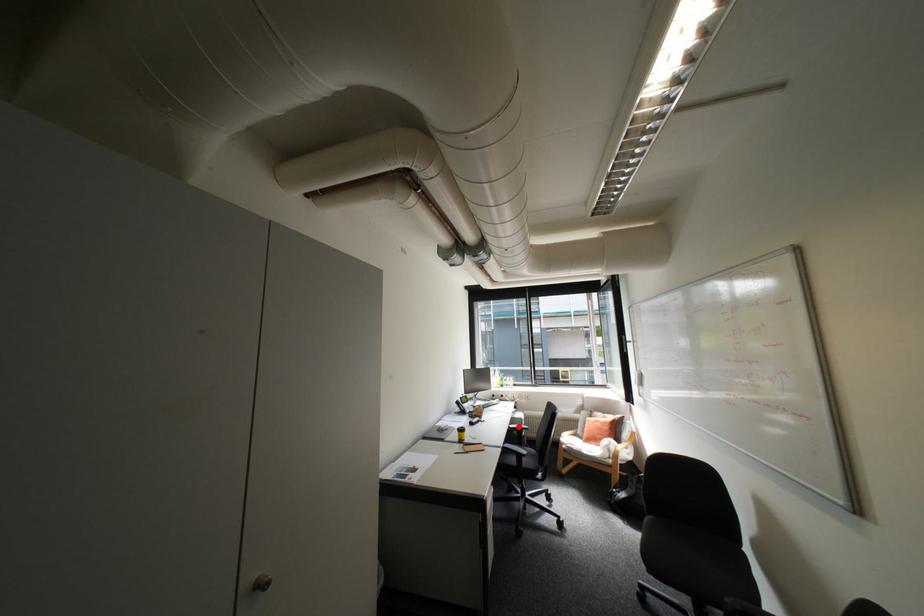
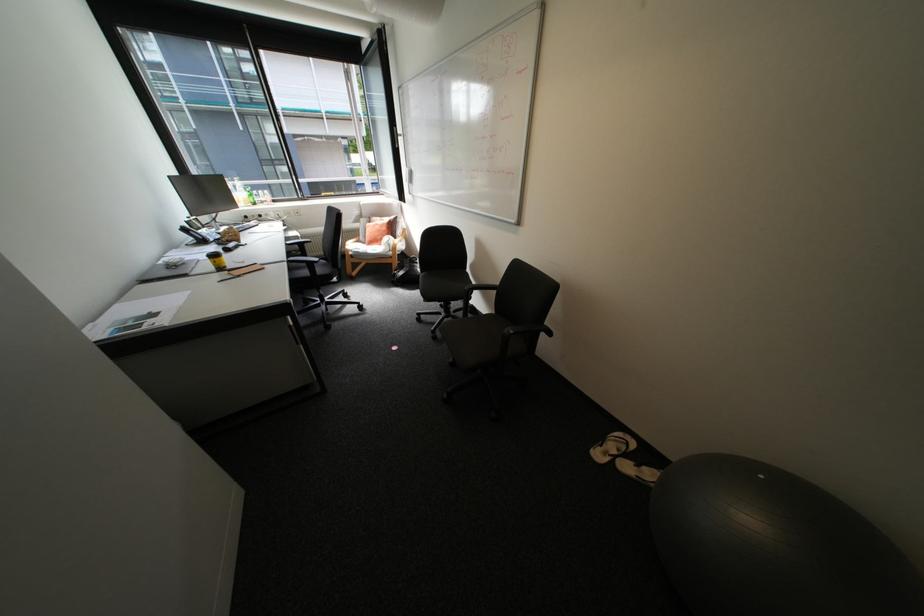
Where in the second image is the point corresponding to the highlighted location from the first image?

(296, 244)